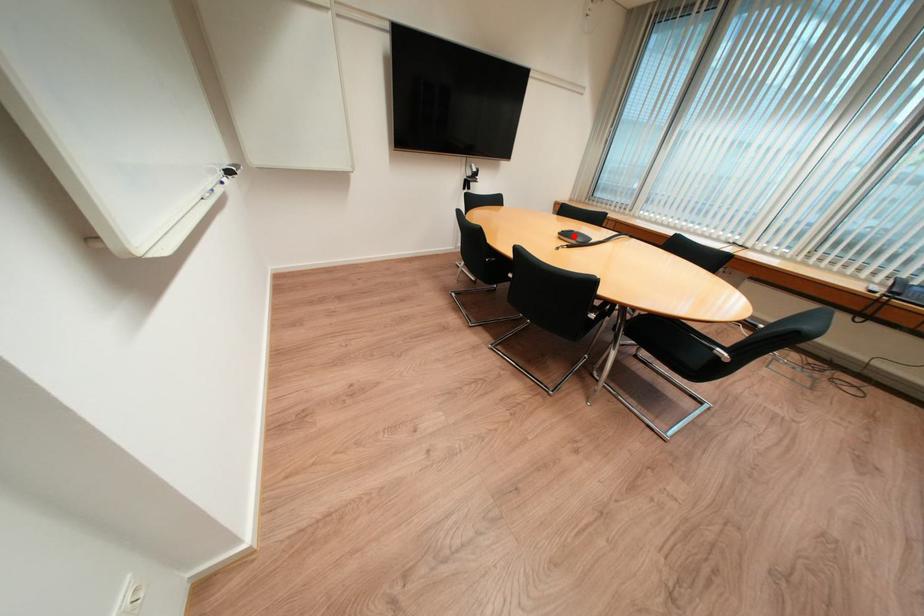
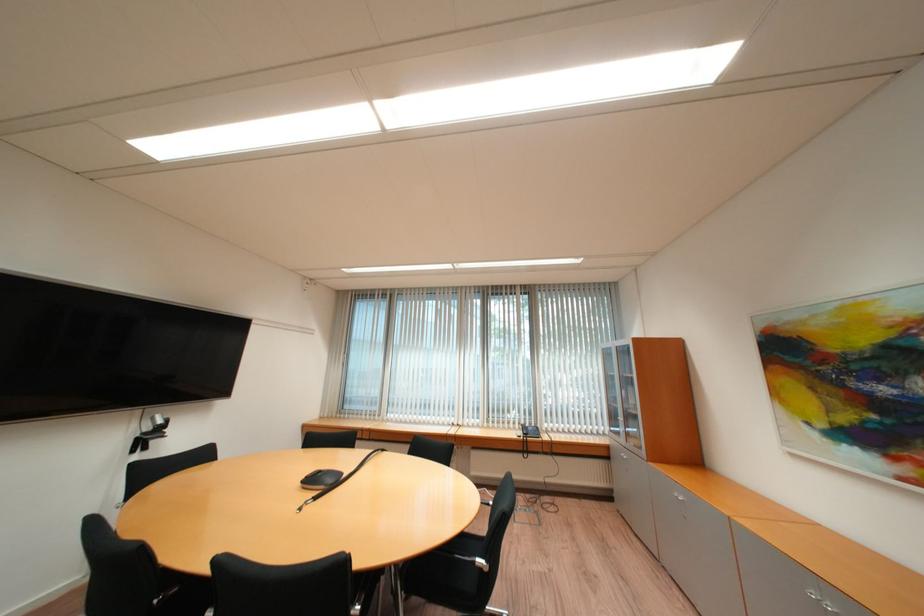
The point at the highlighted location is marked in the first image. Where is the corresponding point in the second image?

(320, 482)